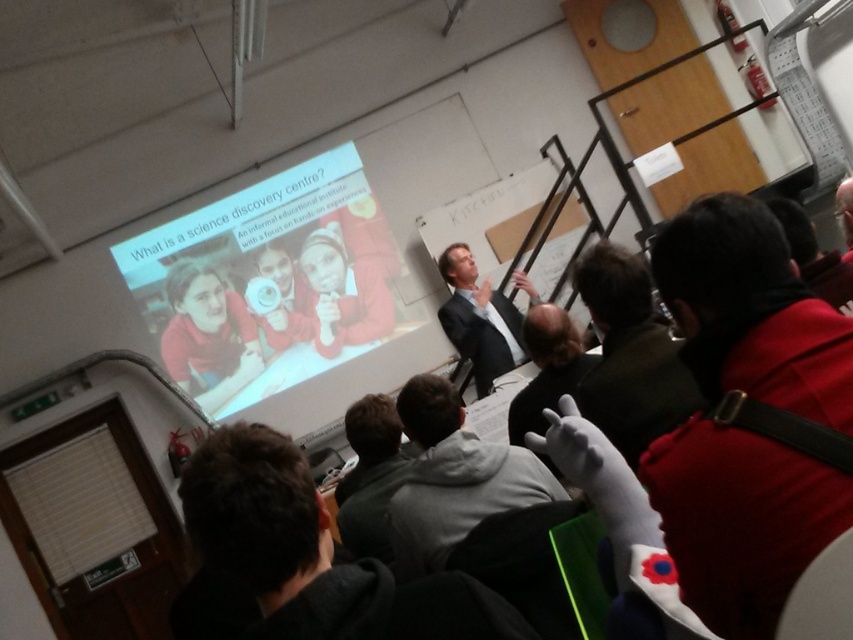
You are sitting in the classroom and need to hand a note to the person wearing the dark gray hoodie at lower right and the red fleece jacket at upper right. Which of the two is closer to your left side?

The dark gray hoodie at lower right is positioned on the left side of red fleece jacket at upper right, so it is closer to your left side.

You are sitting in the classroom and want to see both the white glossy projector screen at upper center and the dark suit at center. Which object is wider from your perspective?

The white glossy projector screen at upper center is wider than the dark suit at center according to the description.